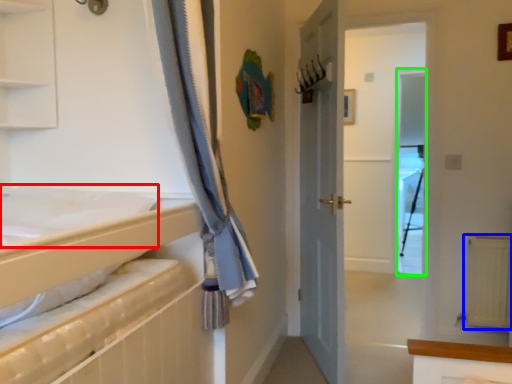
Question: Based on their relative distances, which object is farther from sheet (highlighted by a red box)? Choose from radiator (highlighted by a blue box) and screen door (highlighted by a green box).

Choices:
 (A) radiator
 (B) screen door

Answer: (B)